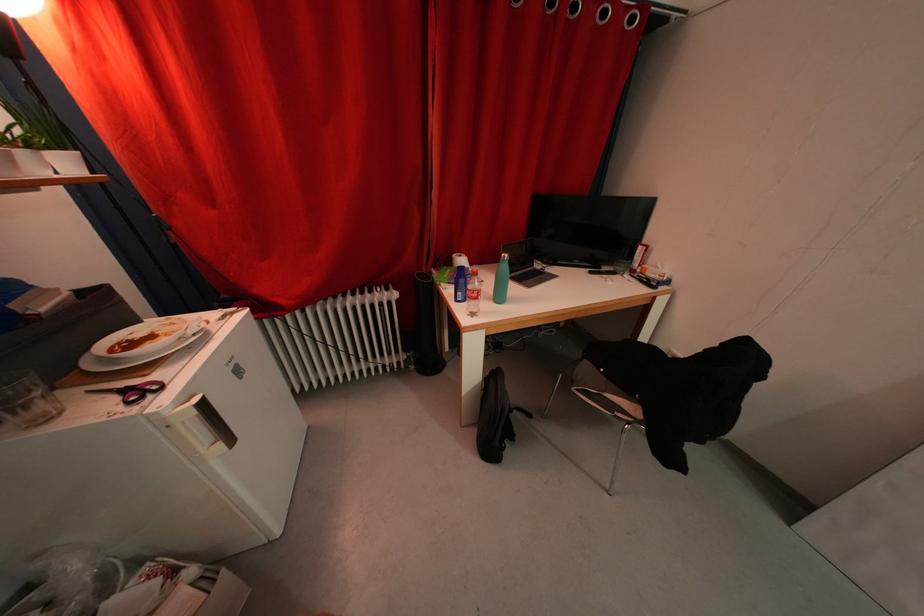
You are a GUI agent. You are given a task and a screenshot of the screen. Output one action in this format:
    pyautogui.click(x=<x>, y=<y>)
    Task: Click on the white ceramic plate
    This screenshot has width=924, height=616.
    Given the screenshot: What is the action you would take?
    pyautogui.click(x=141, y=342)